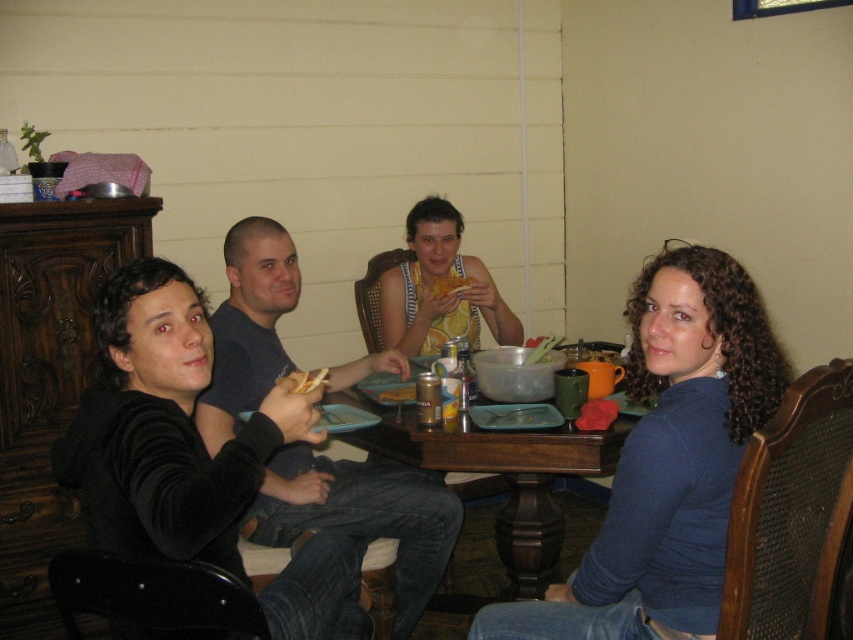
Does point (444, 328) lie in front of point (451, 292)?

No, it is behind (451, 292).

Consider the image. Is the position of yellow fabric tank top at center more distant than that of yellow matte bread at center?

No, it is in front of yellow matte bread at center.

I want to click on yellow fabric tank top at center, so click(x=444, y=296).

At what (x,y) coordinates should I click in order to perform the action: click on yellow fabric tank top at center. Please return your answer as a coordinate pair (x, y). Looking at the image, I should click on (444, 296).

Which is more to the left, blue matte shirt at center or wooden table at center?

wooden table at center

Between point (717, 547) and point (606, 468), which one is positioned in front?

Point (717, 547)

Does point (672, 305) come in front of point (386, 422)?

That is True.

The width and height of the screenshot is (853, 640). Find the location of `blue matte shirt at center`. blue matte shirt at center is located at coordinates (668, 458).

Can you confirm if yellow fabric tank top at center is smaller than metallic can at table center?

Actually, yellow fabric tank top at center might be larger than metallic can at table center.

Who is more forward, (474, 320) or (432, 387)?

Point (432, 387) is more forward.

The image size is (853, 640). I want to click on yellow fabric tank top at center, so click(444, 296).